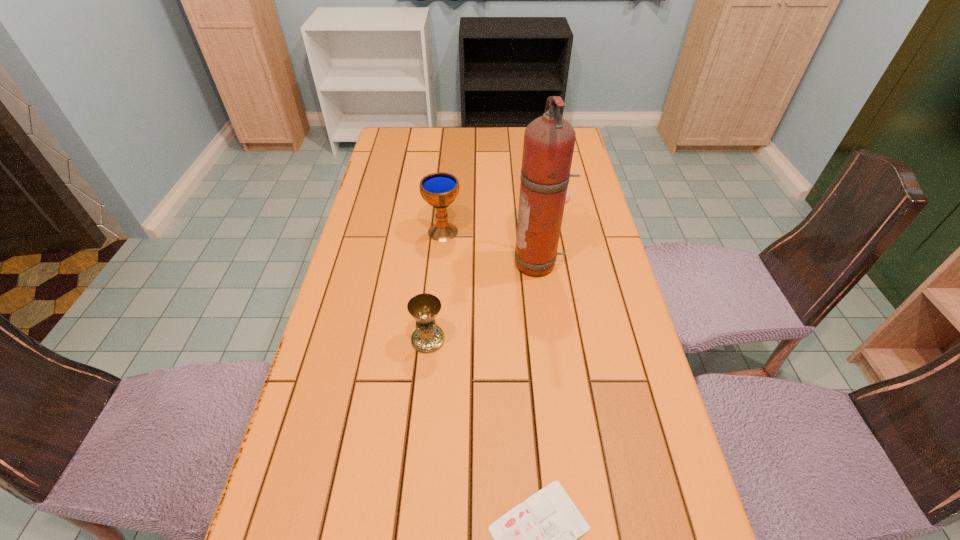
Where is `free space between the tallest object and the taller chalice`? This screenshot has width=960, height=540. free space between the tallest object and the taller chalice is located at coordinates (491, 248).

Find the location of `unoccupied position between the fire extinguisher and the second tallest object`. unoccupied position between the fire extinguisher and the second tallest object is located at coordinates (491, 248).

Locate an element on the screen. The width and height of the screenshot is (960, 540). free space that is in between the nearer chalice and the tallest object is located at coordinates (484, 302).

At what (x,y) coordinates should I click in order to perform the action: click on free space between the second tallest object and the farthest object. Please return your answer as a coordinate pair (x, y). Looking at the image, I should click on (499, 215).

The image size is (960, 540). I want to click on vacant region between the second shortest object and the farther chalice, so click(499, 215).

Locate which object ranks fourth in proximity to the shorter chalice. Please provide its 2D coordinates. Your answer should be formatted as a tuple, i.e. [(x, y)], where the tuple contains the x and y coordinates of a point satisfying the conditions above.

[(568, 193)]

Select which object is the closest to the third shortest object. Please provide its 2D coordinates. Your answer should be formatted as a tuple, i.e. [(x, y)], where the tuple contains the x and y coordinates of a point satisfying the conditions above.

[(549, 140)]

Identify the location of free spot that satisfies the following two spatial constraints: 1. on the back side of the third tallest object; 2. on the right side of the second shortest object. (443, 198).